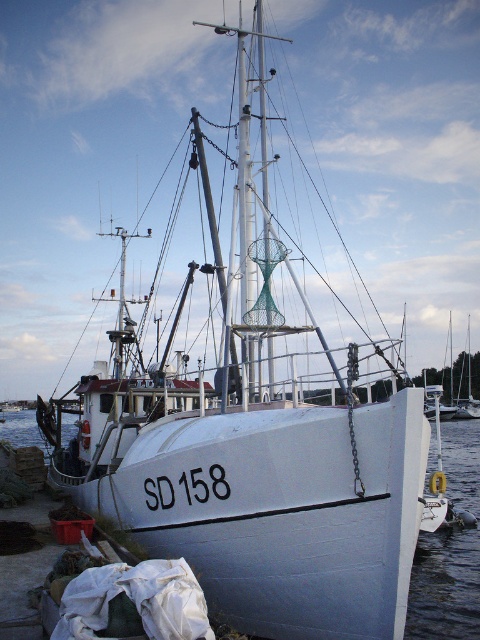
Is white smooth water at lower left shorter than white matte boat at right?

Indeed, white smooth water at lower left has a lesser height compared to white matte boat at right.

How far apart are white smooth water at lower left and white matte boat at right?

They are 7.27 meters apart.

What do you see at coordinates (444, 586) in the screenshot?
I see `white smooth water at lower left` at bounding box center [444, 586].

This screenshot has width=480, height=640. Find the location of `white smooth water at lower left`. white smooth water at lower left is located at coordinates (444, 586).